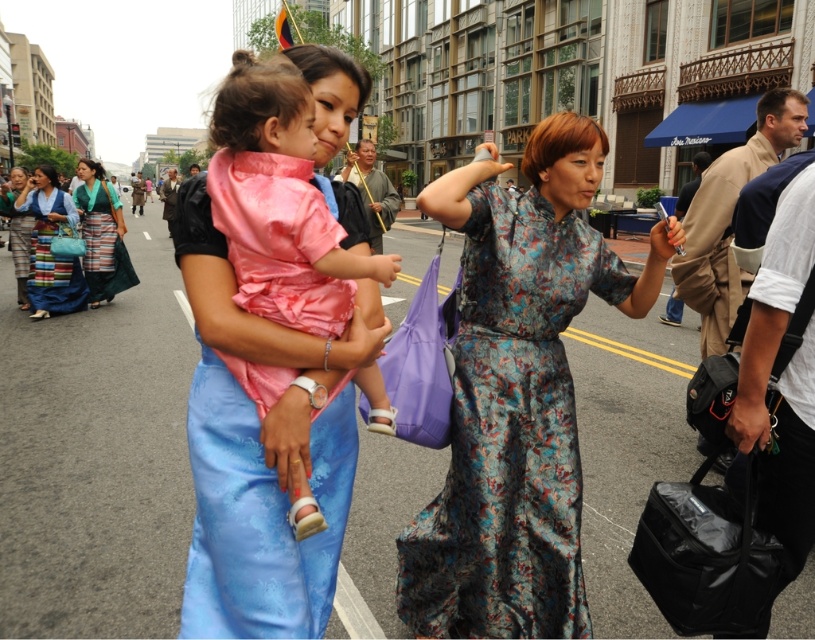
Question: Which of these objects is positioned farthest from the pink satin dress at center?

Choices:
 (A) teal silk dress at center
 (B) blue silk dress at center
 (C) silky pink dress at center

Answer: (B)

Question: Observing the image, what is the correct spatial positioning of pink satin dress at center in reference to teal silk dress at center?

Choices:
 (A) left
 (B) right

Answer: (B)

Question: Which object appears farthest from the camera in this image?

Choices:
 (A) pink satin dress at center
 (B) silky blue dress at lower left
 (C) floral silk dress at center
 (D) silky pink dress at center

Answer: (B)

Question: Is silky pink dress at center bigger than blue silk dress at center?

Choices:
 (A) yes
 (B) no

Answer: (B)

Question: Which point is closer to the camera taking this photo?

Choices:
 (A) (228, 164)
 (B) (33, 198)

Answer: (A)

Question: Is the position of silky pink dress at center less distant than that of silky blue dress at lower left?

Choices:
 (A) no
 (B) yes

Answer: (B)